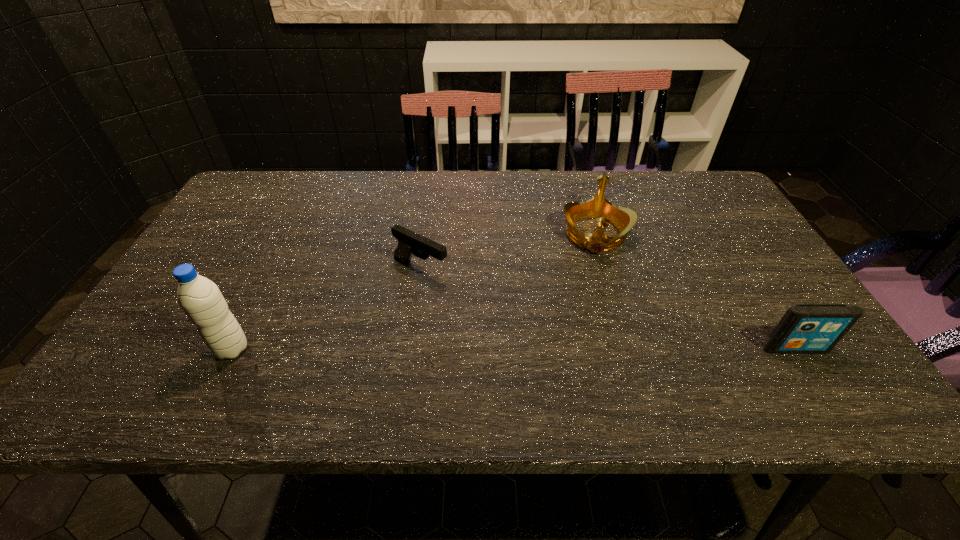
Where is `free space located 0.330m on the front-facing side of the shortest object`? Image resolution: width=960 pixels, height=540 pixels. free space located 0.330m on the front-facing side of the shortest object is located at coordinates (561, 339).

This screenshot has height=540, width=960. What are the coordinates of `free space located on the front-facing side of the shortest object` in the screenshot? It's located at (463, 288).

Where is `free location located on the front-facing side of the shortest object`? Image resolution: width=960 pixels, height=540 pixels. free location located on the front-facing side of the shortest object is located at coordinates (496, 306).

Locate an element on the screen. The image size is (960, 540). object that is at the far edge is located at coordinates (598, 207).

Where is `water bottle situated at the near edge`? water bottle situated at the near edge is located at coordinates (200, 298).

Identify the location of iPod located in the near edge section of the desktop. The width and height of the screenshot is (960, 540). (805, 328).

Image resolution: width=960 pixels, height=540 pixels. In order to click on object at the right edge in this screenshot , I will do `click(805, 328)`.

You are a GUI agent. You are given a task and a screenshot of the screen. Output one action in this format:
    pyautogui.click(x=<x>, y=<y>)
    Task: Click on the object that is at the near right corner
    The image size is (960, 540).
    Given the screenshot: What is the action you would take?
    pyautogui.click(x=805, y=328)

In the image, there is a desktop. At what (x,y) coordinates should I click in order to perform the action: click on blank space at the far edge. Please return your answer as a coordinate pair (x, y). The image size is (960, 540). Looking at the image, I should click on (323, 186).

Locate an element on the screen. Image resolution: width=960 pixels, height=540 pixels. free space at the near edge is located at coordinates (505, 349).